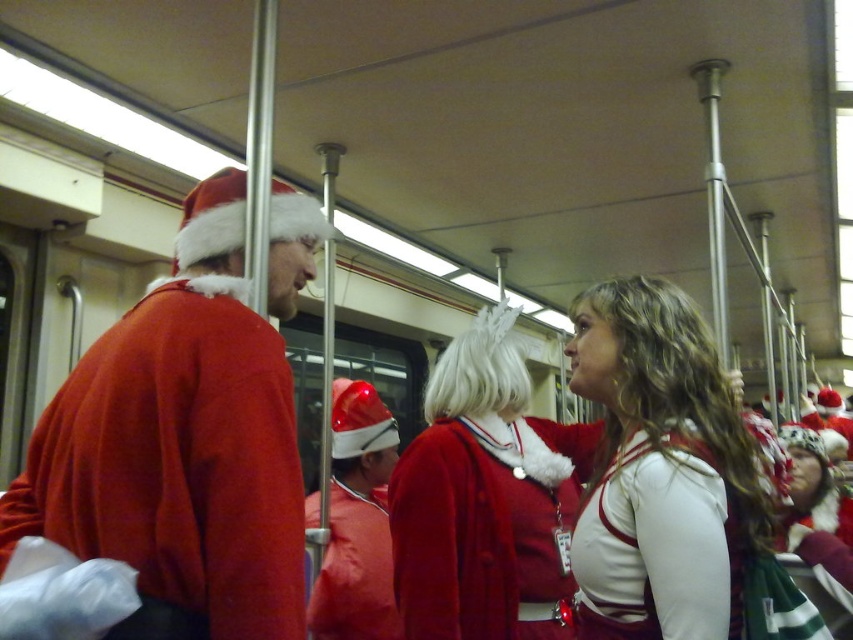
Question: Does white matte sweater at center appear under fuzzy red coat at center?

Choices:
 (A) yes
 (B) no

Answer: (B)

Question: Is white matte sweater at center thinner than fuzzy red coat at center?

Choices:
 (A) no
 (B) yes

Answer: (B)

Question: Is white matte sweater at center to the left of fuzzy red coat at center from the viewer's perspective?

Choices:
 (A) no
 (B) yes

Answer: (A)

Question: Which point appears closest to the camera in this image?

Choices:
 (A) 346,582
 (B) 701,371
 (C) 486,467

Answer: (B)

Question: Based on their relative distances, which object is farther from the white matte sweater at center?

Choices:
 (A) matte red santa hat at center
 (B) matte red sweater at left

Answer: (A)

Question: Which object is positioned closest to the fuzzy red coat at center?

Choices:
 (A) white matte sweater at center
 (B) matte red sweater at left

Answer: (A)